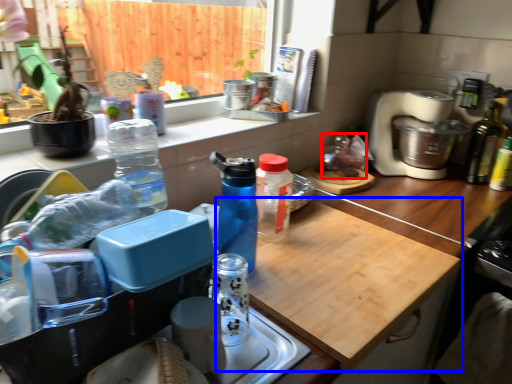
Question: Among these objects, which one is nearest to the camera, food (highlighted by a red box) or cutting board (highlighted by a blue box)?

Choices:
 (A) food
 (B) cutting board

Answer: (B)